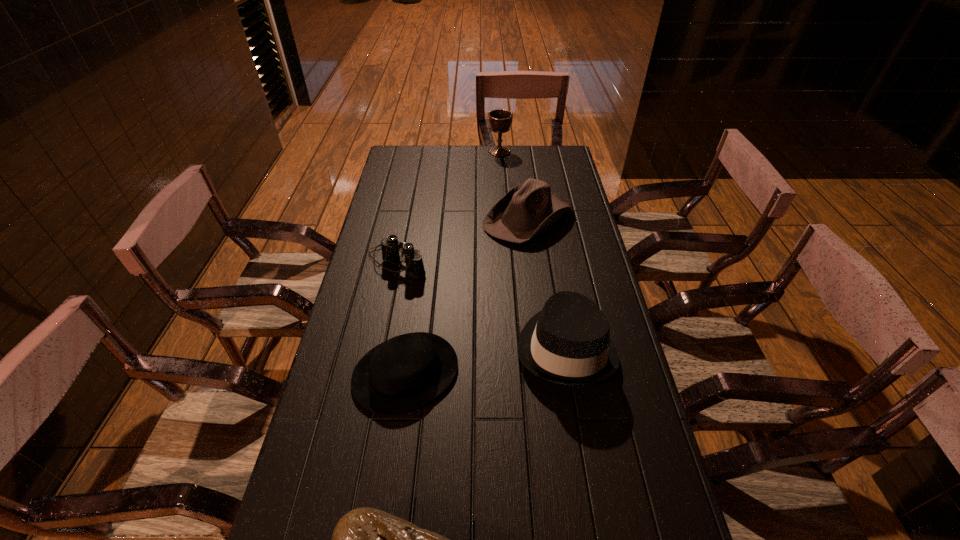
At what (x,y) coordinates should I click in order to perform the action: click on object positioned at the far edge. Please return your answer as a coordinate pair (x, y). Looking at the image, I should click on (500, 120).

The width and height of the screenshot is (960, 540). In order to click on binoculars located at the left edge in this screenshot , I will do `click(390, 253)`.

Where is `fedora situated at the left edge`? The image size is (960, 540). fedora situated at the left edge is located at coordinates (403, 373).

I want to click on free space at the far edge of the desktop, so click(512, 171).

The height and width of the screenshot is (540, 960). I want to click on vacant space at the left edge of the desktop, so click(x=391, y=281).

Locate an element on the screen. The height and width of the screenshot is (540, 960). free space at the right edge is located at coordinates (586, 214).

In the image, there is a desktop. Where is `vacant space at the far right corner`? vacant space at the far right corner is located at coordinates (559, 163).

Where is `unoccupied area between the chalice and the second shortest fedora`? The height and width of the screenshot is (540, 960). unoccupied area between the chalice and the second shortest fedora is located at coordinates (514, 185).

The image size is (960, 540). In order to click on unoccupied area between the leftmost fedora and the tallest fedora in this screenshot , I will do (486, 360).

Identify the location of vacant space in between the tallest fedora and the chalice. (533, 249).